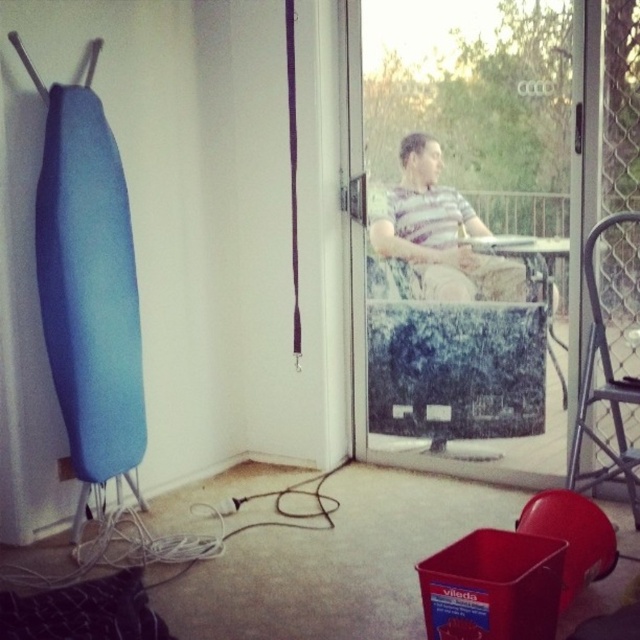
Question: Which point is farther to the camera?

Choices:
 (A) (600, 339)
 (B) (483, 401)
 (C) (490, 298)

Answer: (B)

Question: Observing the image, what is the correct spatial positioning of transparent glass door at center in reference to striped fabric shirt at center?

Choices:
 (A) left
 (B) right

Answer: (B)

Question: Which point is farther from the camera taking this photo?

Choices:
 (A) (532, 422)
 (B) (470, 250)

Answer: (B)

Question: Can you confirm if transparent glass door at center is positioned below metallic silver chair at right?

Choices:
 (A) no
 (B) yes

Answer: (A)

Question: Is transparent glass door at center closer to camera compared to metallic silver chair at right?

Choices:
 (A) yes
 (B) no

Answer: (B)

Question: Estimate the real-world distances between objects in this image. Which object is closer to the metallic silver chair at right?

Choices:
 (A) striped fabric shirt at center
 (B) transparent glass door at center

Answer: (B)